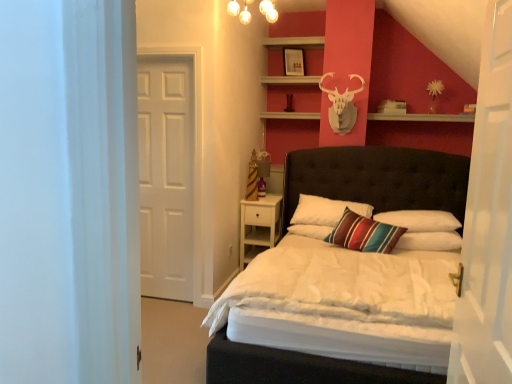
Question: Would you say tufted leather bed at center is inside or outside white matte door at left, which appears as the 1th door when viewed from the left?

Choices:
 (A) outside
 (B) inside

Answer: (A)

Question: Is tufted leather bed at center bigger or smaller than white matte door at left, which is the second door from front to back?

Choices:
 (A) small
 (B) big

Answer: (B)

Question: Which object is positioned farthest from the matte white picture frame at upper center?

Choices:
 (A) white wood nightstand at center
 (B) matte glass chandelier at upper center
 (C) white wooden door at right, which appears as the first door when viewed from the front
 (D) white matte door at left, which appears as the 1th door when viewed from the left
 (E) white soft pillow at center, which appears as the second pillow when viewed from the left

Answer: (C)

Question: Which object is positioned farthest from the tufted leather bed at center?

Choices:
 (A) matte white picture frame at upper center
 (B) white matte door at left, which ranks as the first door in back-to-front order
 (C) white soft pillow at center, marked as the third pillow in a left-to-right arrangement
 (D) white soft pillow at center, which appears as the second pillow when viewed from the left
 (E) striped fabric pillow at center, which is the third pillow in right-to-left order

Answer: (B)